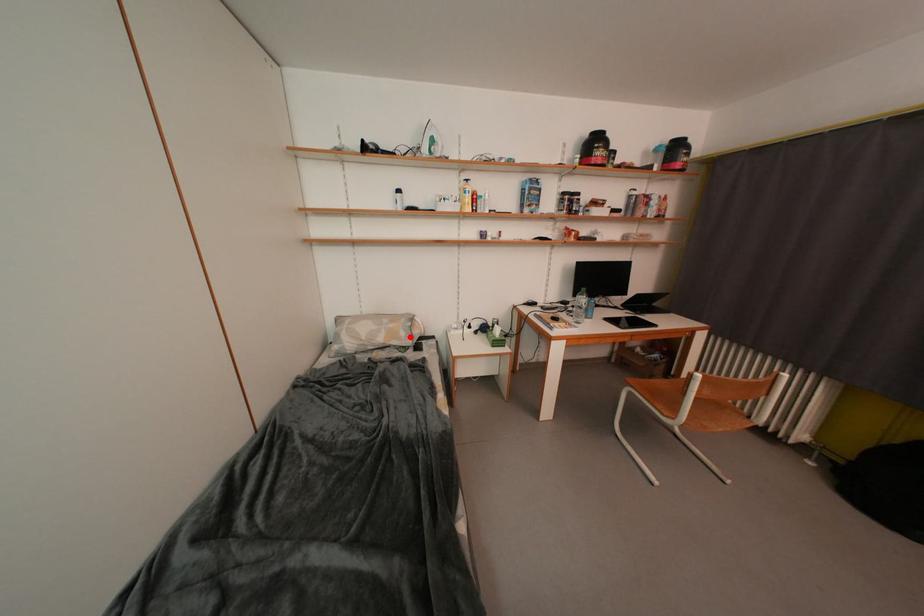
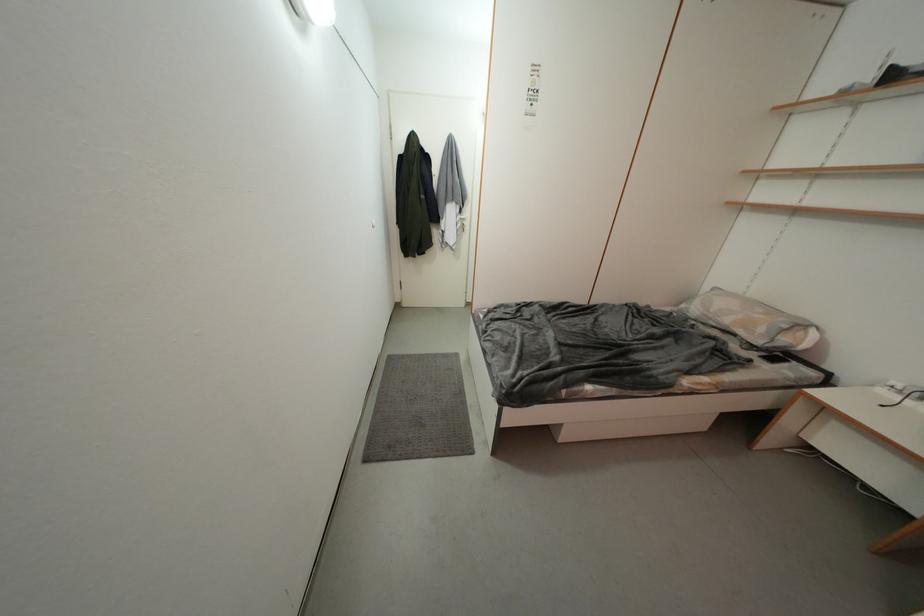
In the second image, find the point that corresponds to the highlighted location in the first image.

(769, 333)